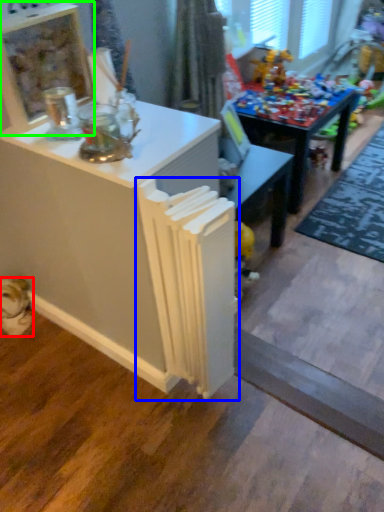
Question: Which object is the farthest from animal (highlighted by a red box)? Choose among these: radiator (highlighted by a blue box) or shelf (highlighted by a green box).

Choices:
 (A) radiator
 (B) shelf

Answer: (B)